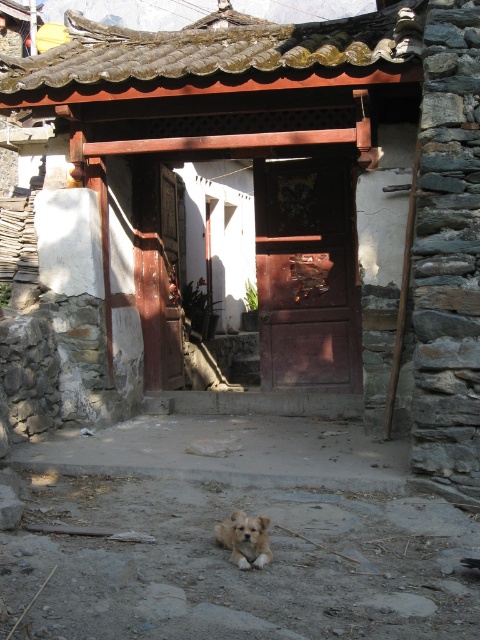
Which is behind, point (200, 150) or point (260, 195)?

The point (260, 195) is more distant.

Which is behind, point (151, 161) or point (332, 157)?

Point (151, 161)

Identify the location of wooden door at center. Image resolution: width=480 pixels, height=640 pixels. [x=227, y=157].

Does wooden door at center have a lesser height compared to light brown fur dog at center?

Correct, wooden door at center is not as tall as light brown fur dog at center.

Describe the element at coordinates (227, 157) in the screenshot. I see `wooden door at center` at that location.

Where is `wooden door at center`? The height and width of the screenshot is (640, 480). wooden door at center is located at coordinates (227, 157).

Which is more to the right, dark wood door at center or light brown fur dog at center?

dark wood door at center

Is point (333, 172) behind point (253, 560)?

Yes, it is behind point (253, 560).

Locate an element on the screen. The width and height of the screenshot is (480, 640). dark wood door at center is located at coordinates (307, 275).